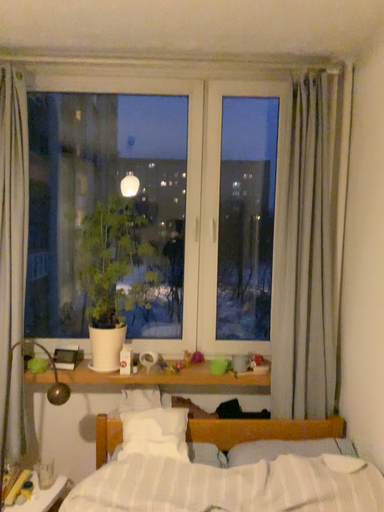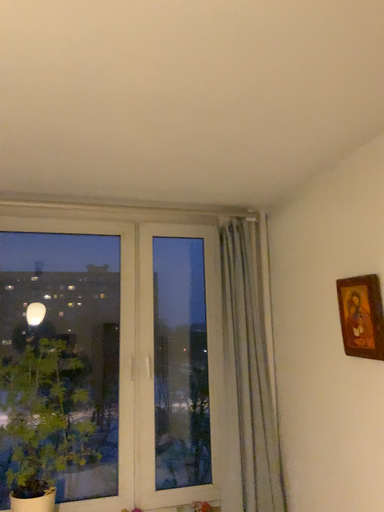
Question: How did the camera likely rotate when shooting the video?

Choices:
 (A) rotated upward
 (B) rotated downward

Answer: (A)